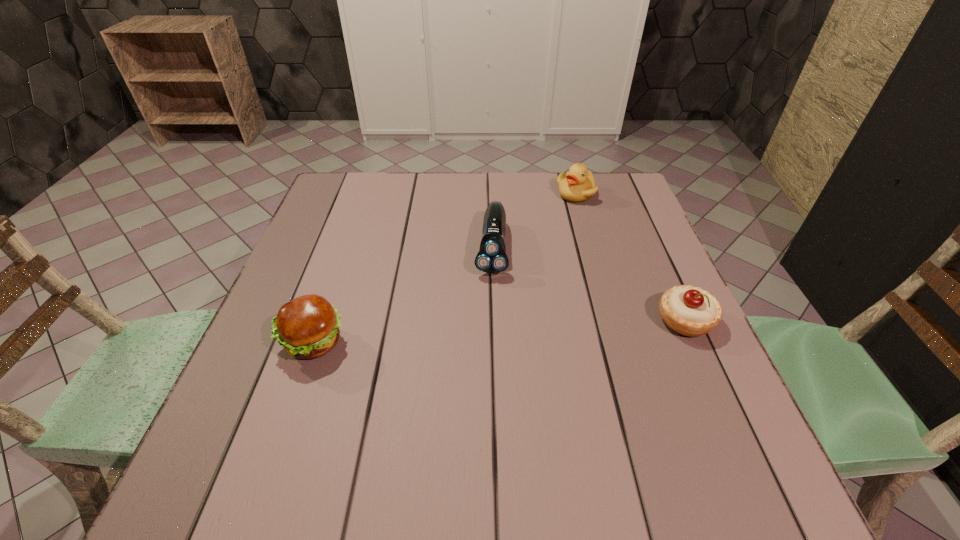
Locate an element on the screen. free space on the desktop that is between the hamburger and the rightmost object and is positioned on the head of the third nearest object is located at coordinates (484, 333).

Where is `free space on the desktop that is between the hamburger and the rightmost object and is positioned on the beak of the duckling`? The width and height of the screenshot is (960, 540). free space on the desktop that is between the hamburger and the rightmost object and is positioned on the beak of the duckling is located at coordinates (554, 328).